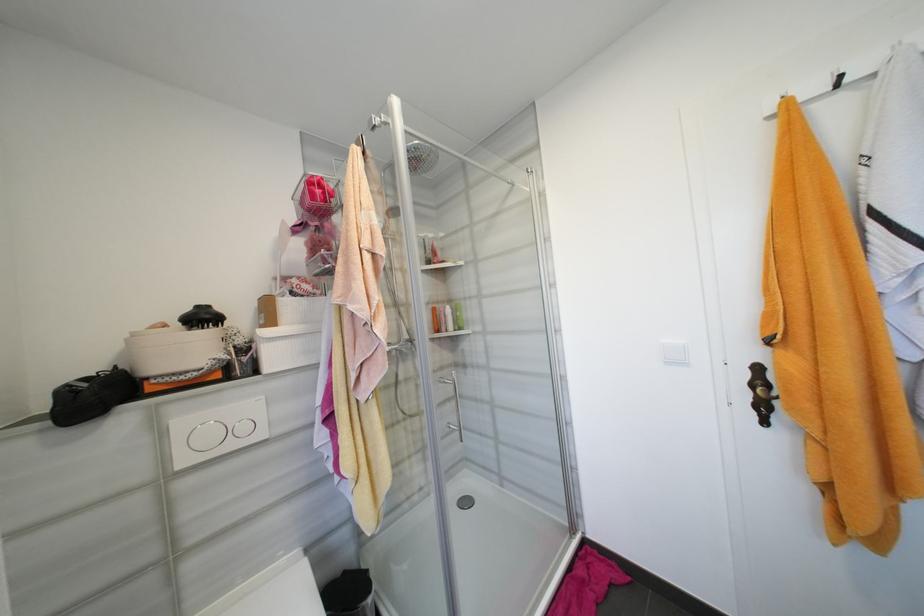
This screenshot has height=616, width=924. What do you see at coordinates (675, 353) in the screenshot?
I see `the white light switch` at bounding box center [675, 353].